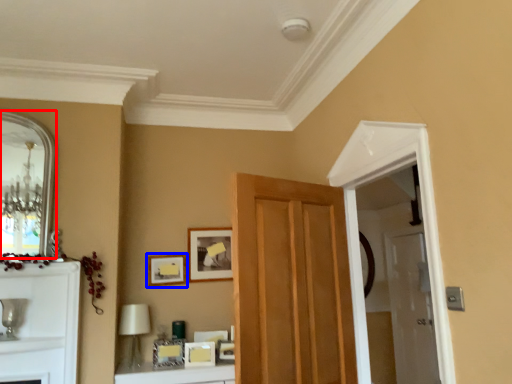
Question: Which object is closer to the camera taking this photo, mirror (highlighted by a red box) or picture frame (highlighted by a blue box)?

Choices:
 (A) mirror
 (B) picture frame

Answer: (A)